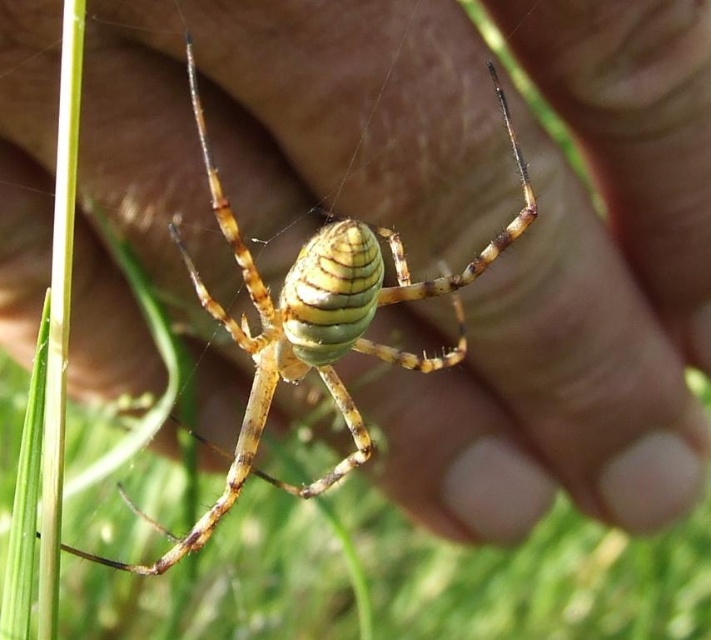
You are a small insect flying towards the green grass at center and the yellow striped spider at center. Which object will you encounter first based on their sizes?

The green grass at center has a larger width than the yellow striped spider at center, so you will encounter the green grass at center first.

You are a small insect flying towards the yellow striped spider at center. Which direction should you fly to avoid landing on the green grass at center?

The green grass at center is positioned under the yellow striped spider at center, so to avoid landing on the green grass at center, you should fly upwards away from the grass.